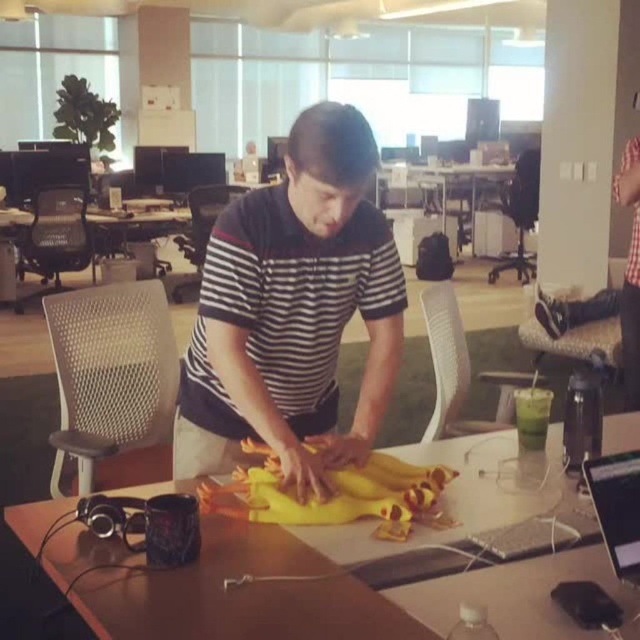
You are organizing a desk and need to place the striped cotton shirt at center and the yellow rubber duck at center. Since the desk has limited vertical space, which item should you prioritize placing first to ensure both fit vertically?

The striped cotton shirt at center is taller than the yellow rubber duck at center, so you should place the striped cotton shirt at center first to accommodate its greater height, then position the yellow rubber duck at center underneath or beside it.

Based on the photo, you are an office worker who needs to reach both the striped cotton shirt at center and the yellow fabric at center on your desk. What is the minimum distance you need to move your hand to touch both items?

The minimum distance you need to move your hand to touch both the striped cotton shirt at center and the yellow fabric at center is 15.65 inches, as they are 15.65 inches apart from each other.